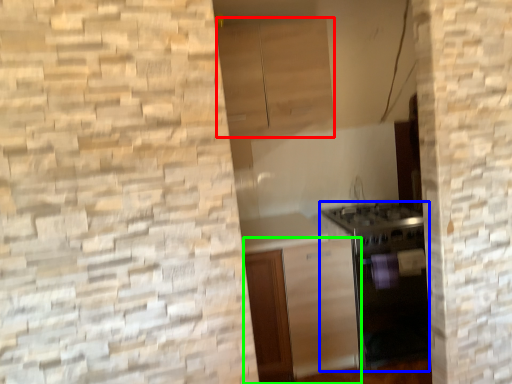
Question: Based on their relative distances, which object is nearer to cabinetry (highlighted by a red box)? Choose from oven (highlighted by a blue box) and cabinetry (highlighted by a green box).

Choices:
 (A) oven
 (B) cabinetry

Answer: (A)